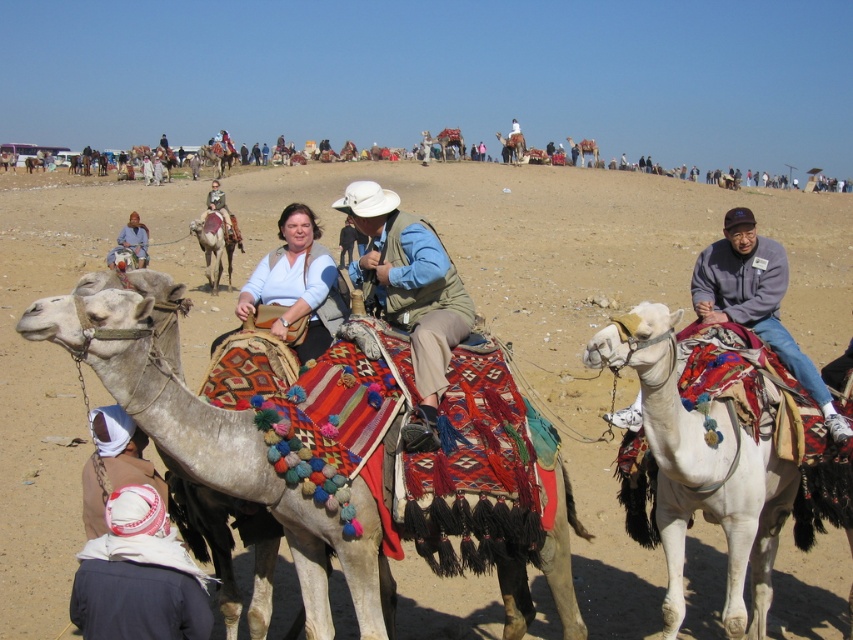
You are a photographer trying to capture the desert camel ride scene. You want to focus on the two points marked in the image. Which point, point (289, 209) or point (228, 209), is closer to your camera lens?

Point (289, 209) is closer to the camera than point (228, 209).

You are a photographer trying to capture a photo of the gray fleece jacket at right and the light brown leather jacket at center. Which jacket should you zoom in on to ensure both are clearly visible in the frame?

The gray fleece jacket at right is smaller in size compared to the light brown leather jacket at center, so you should zoom in on the gray fleece jacket at right to ensure both are clearly visible in the frame.

You are a photographer trying to capture a photo of the gray fleece jacket at right and the white textured camel at center. Based on their positions, which object is closer to the camera?

The white textured camel at center is positioned under the gray fleece jacket at right, meaning the camel is closer to the camera than the jacket.